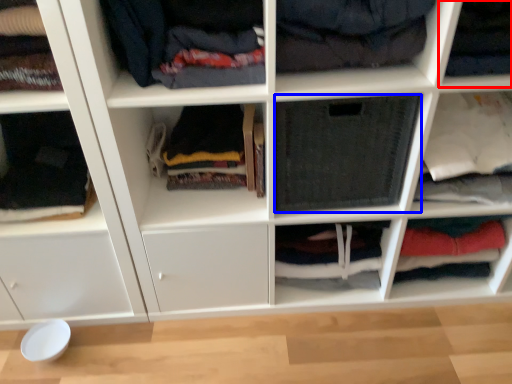
Question: Among these objects, which one is farthest to the camera, shelf (highlighted by a red box) or clothing (highlighted by a blue box)?

Choices:
 (A) shelf
 (B) clothing

Answer: (B)